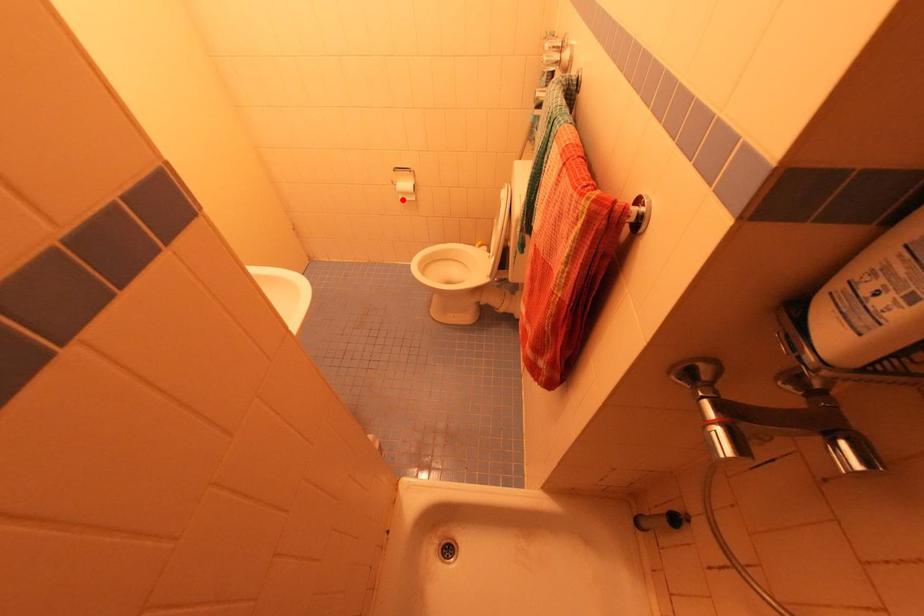
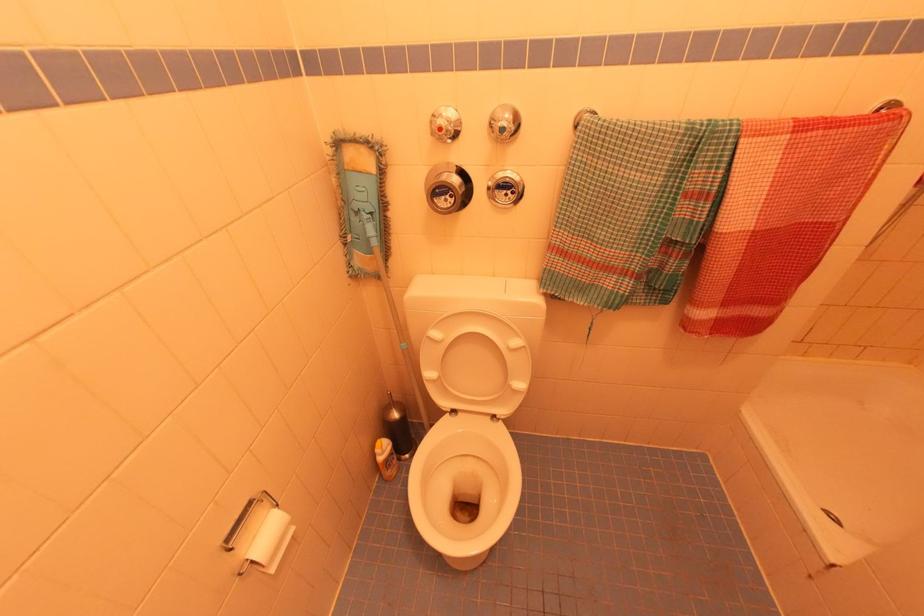
Question: I am providing you with two images of the same scene from different viewpoints. Given a red point in image1, look at the same physical point in image2. Is it:

Choices:
 (A) Closer to the viewpoint
 (B) Farther from the viewpoint

Answer: (B)